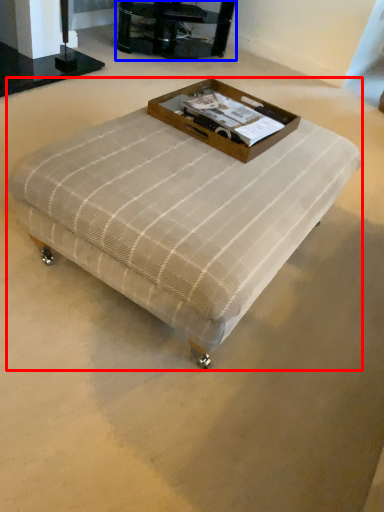
Question: Among these objects, which one is farthest to the camera, table (highlighted by a red box) or furniture (highlighted by a blue box)?

Choices:
 (A) table
 (B) furniture

Answer: (B)